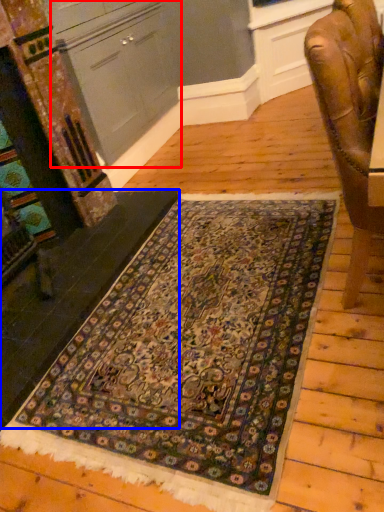
Question: Which of the following is the farthest to the observer, cabinetry (highlighted by a red box) or stair (highlighted by a blue box)?

Choices:
 (A) cabinetry
 (B) stair

Answer: (A)